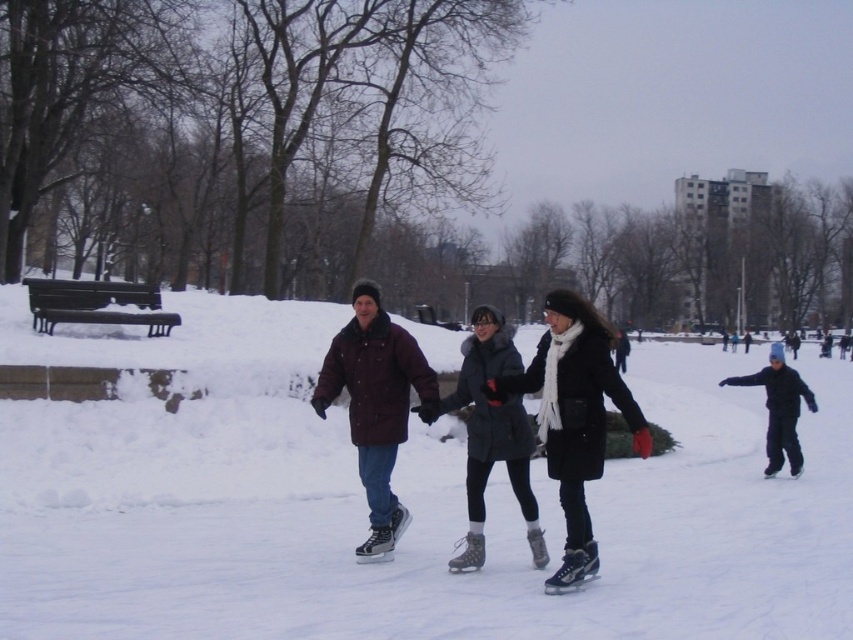
In the winter ice skating scene, you notice two people wearing the black matte coat at center and the maroon woolen jacket at center. Which person is shorter in height?

The black matte coat at center is not as tall as maroon woolen jacket at center, so the person wearing the black matte coat at center is shorter.